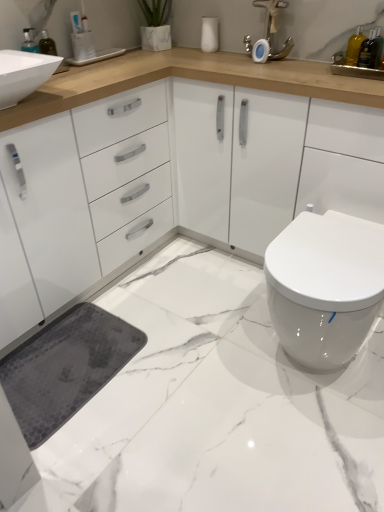
Identify the location of free space in front of translucent glass bottle at upper right, the 2th sink from the left. Image resolution: width=384 pixels, height=512 pixels. (356, 77).